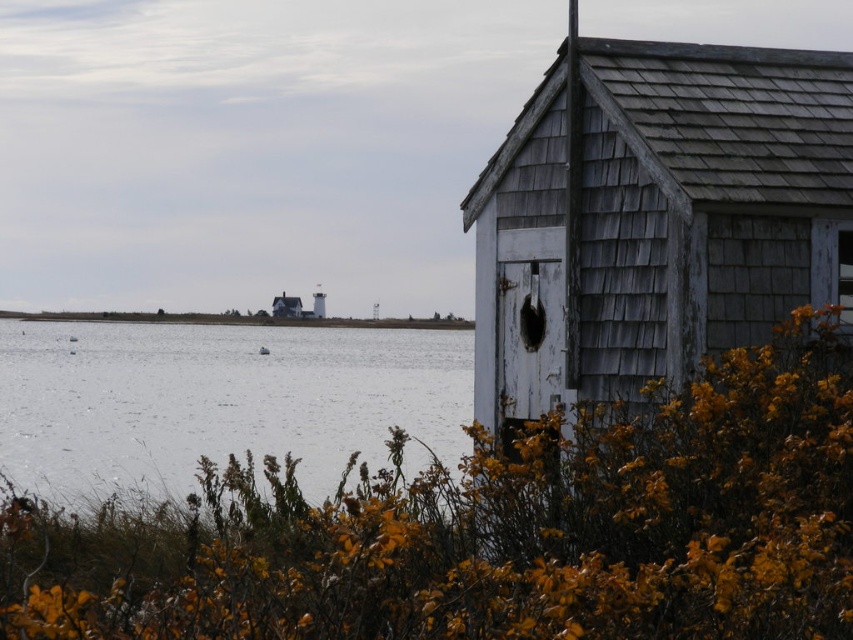
Question: Which point appears farthest from the camera in this image?

Choices:
 (A) (546, 365)
 (B) (138, 429)

Answer: (B)

Question: Does weathered wood hut at right have a greater width compared to white water at center?

Choices:
 (A) yes
 (B) no

Answer: (B)

Question: Is weathered wood hut at right wider than white water at center?

Choices:
 (A) no
 (B) yes

Answer: (A)

Question: Which point is closer to the camera?

Choices:
 (A) (653, 132)
 (B) (293, 380)

Answer: (A)

Question: Does weathered wood hut at right have a smaller size compared to white water at center?

Choices:
 (A) no
 (B) yes

Answer: (B)